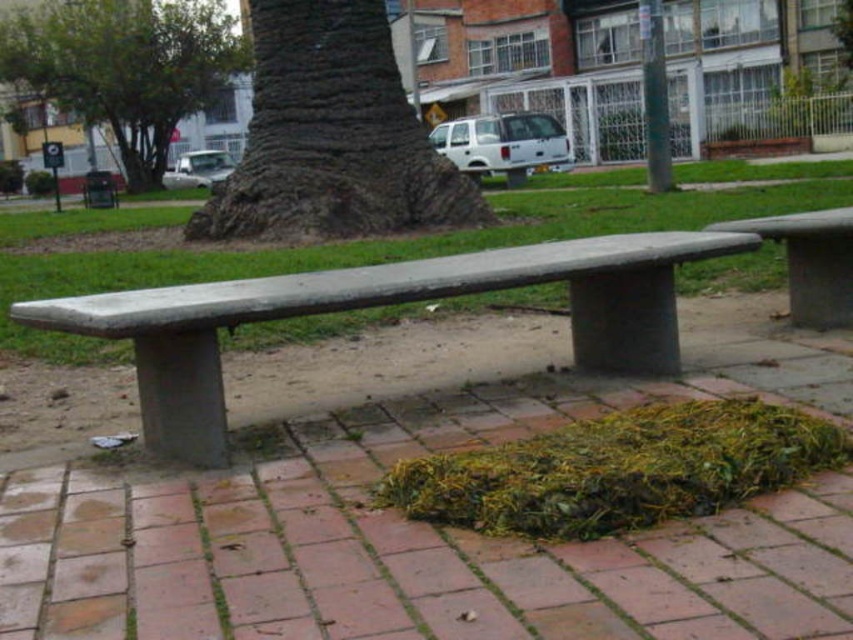
Is gray concrete bench at center bigger than brown rough bark at center?

Correct, gray concrete bench at center is larger in size than brown rough bark at center.

Is point (49, 595) positioned in front of point (302, 97)?

Yes.

Find the location of `gray concrete bench at center`. gray concrete bench at center is located at coordinates 396,515.

Is point (343, 616) behind point (631, 289)?

No, (343, 616) is closer to viewer.

The image size is (853, 640). Describe the element at coordinates (396, 515) in the screenshot. I see `gray concrete bench at center` at that location.

Identify the location of gray concrete bench at center. The width and height of the screenshot is (853, 640). (396, 515).

Between gray concrete bench at center and smooth concrete bench at right, which one has more height?

gray concrete bench at center

How far apart are gray concrete bench at center and smooth concrete bench at right?

gray concrete bench at center and smooth concrete bench at right are 1.84 meters apart.

Locate an element on the screen. The image size is (853, 640). gray concrete bench at center is located at coordinates (396, 515).